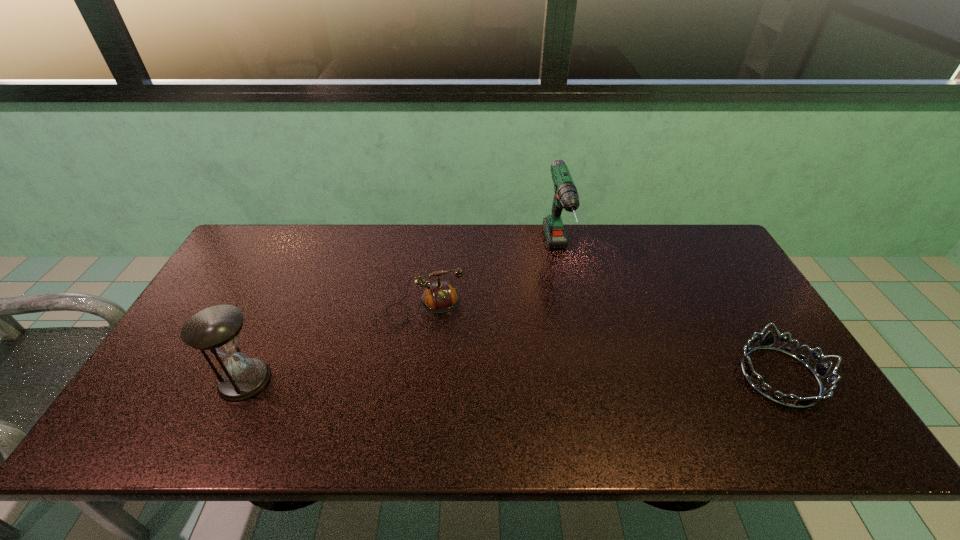
Identify the location of object at the near left corner. (216, 329).

This screenshot has height=540, width=960. I want to click on object present at the near right corner, so click(x=820, y=370).

Find the location of a particular element. The height and width of the screenshot is (540, 960). vacant space at the far edge is located at coordinates (401, 240).

Identify the location of vacant space at the near edge. (258, 408).

In the image, there is a desktop. Where is `vacant space at the left edge`? This screenshot has width=960, height=540. vacant space at the left edge is located at coordinates (187, 372).

At what (x,y) coordinates should I click in order to perform the action: click on vacant space at the far left corner of the desktop. Please return your answer as a coordinate pair (x, y). Looking at the image, I should click on (283, 249).

Locate an element on the screen. This screenshot has width=960, height=540. vacant space at the far right corner is located at coordinates click(716, 257).

The height and width of the screenshot is (540, 960). Identify the location of vacant space that's between the third shortest object and the drill. (401, 317).

At what (x,y) coordinates should I click in order to perform the action: click on vacant area between the second shortest object and the farthest object. Please return your answer as a coordinate pair (x, y). The width and height of the screenshot is (960, 540). Looking at the image, I should click on (489, 280).

Locate an element on the screen. The width and height of the screenshot is (960, 540). free area in between the drill and the hourglass is located at coordinates (401, 317).